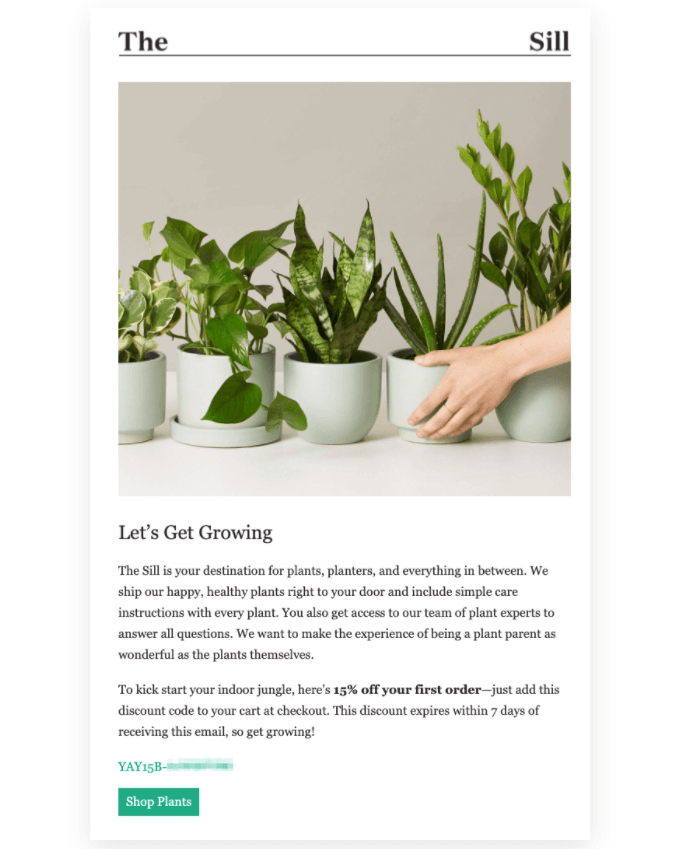
You are a GUI agent. You are given a task and a screenshot of the screen. Output one action in this format:
    pyautogui.click(x=<x>, y=<y>)
    Task: Click on the flower pots
    The width and height of the screenshot is (685, 849).
    Given the screenshot: What is the action you would take?
    pyautogui.click(x=137, y=408), pyautogui.click(x=188, y=389), pyautogui.click(x=322, y=392), pyautogui.click(x=401, y=391), pyautogui.click(x=540, y=402)